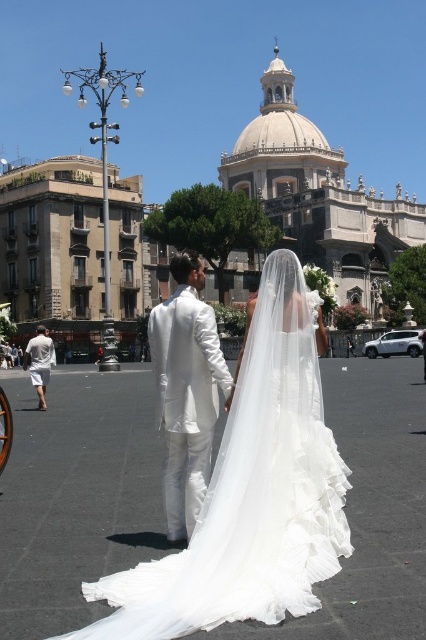
Is white satin suit at center to the right of white cotton shorts at lower left from the viewer's perspective?

Correct, you'll find white satin suit at center to the right of white cotton shorts at lower left.

Which is behind, point (203, 499) or point (46, 340)?

Positioned behind is point (46, 340).

I want to click on white satin suit at center, so click(x=186, y=390).

Which is in front, point (230, 506) or point (192, 499)?

Point (230, 506) is in front.

This screenshot has width=426, height=640. Describe the element at coordinates (250, 500) in the screenshot. I see `matte white gown at center` at that location.

Identify the location of matte white gown at center. (250, 500).

Locate an element on the screen. The width and height of the screenshot is (426, 640). matte white gown at center is located at coordinates (250, 500).

Which is behind, point (244, 387) or point (43, 349)?

The point (43, 349) is behind.

Does matte white gown at center appear on the right side of white cotton shorts at lower left?

Indeed, matte white gown at center is positioned on the right side of white cotton shorts at lower left.

Which is in front, point (298, 360) or point (52, 356)?

Point (298, 360) is more forward.

Image resolution: width=426 pixels, height=640 pixels. Find the location of `matte white gown at center`. matte white gown at center is located at coordinates (250, 500).